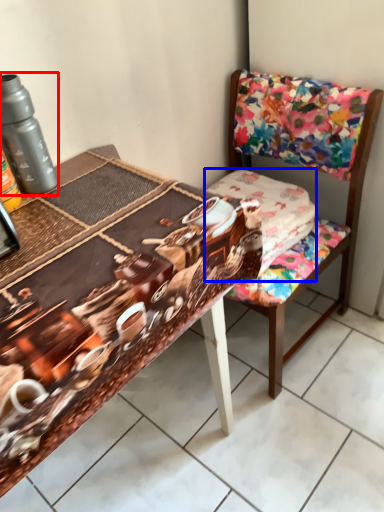
Question: Which point is further to the camera, bottle (highlighted by a red box) or fabric (highlighted by a blue box)?

Choices:
 (A) bottle
 (B) fabric

Answer: (B)